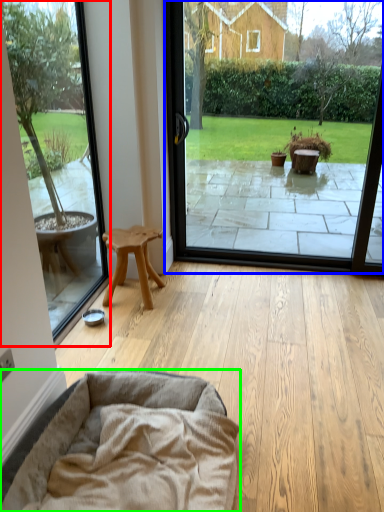
Question: Which is nearer to the window screen (highlighted by a red box)? window screen (highlighted by a blue box) or dog bed (highlighted by a green box).

Choices:
 (A) window screen
 (B) dog bed

Answer: (B)